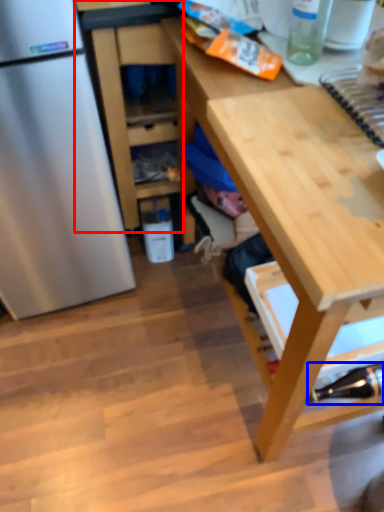
Question: Which point is further to the camera, cabinetry (highlighted by a red box) or bottle (highlighted by a blue box)?

Choices:
 (A) cabinetry
 (B) bottle

Answer: (A)